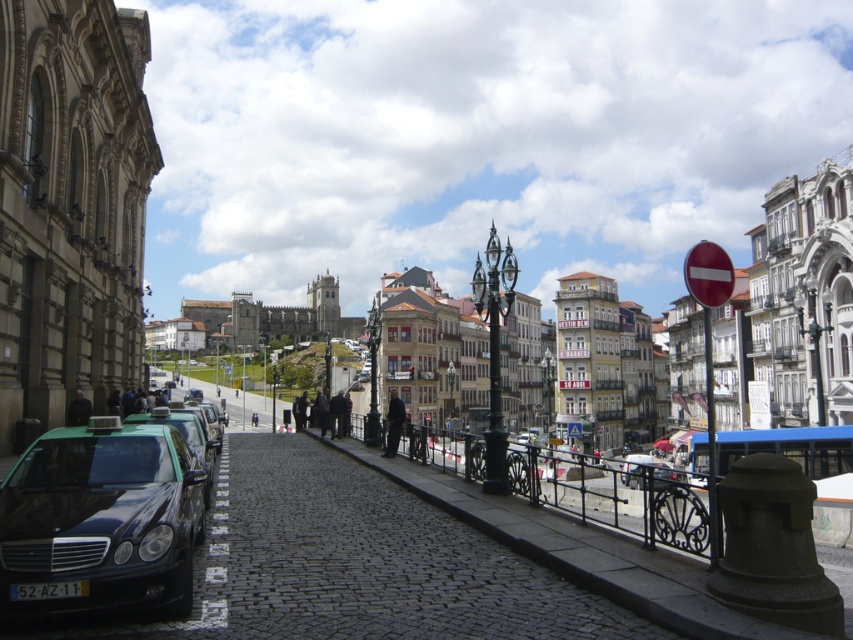
You are a photographer standing on the cobblestone street in the scene. You notice a dark gray fabric jacket at lower left and dark blue jeans at center. Which clothing item appears shorter in the image?

The dark gray fabric jacket at lower left appears shorter than the dark blue jeans at center in the image.